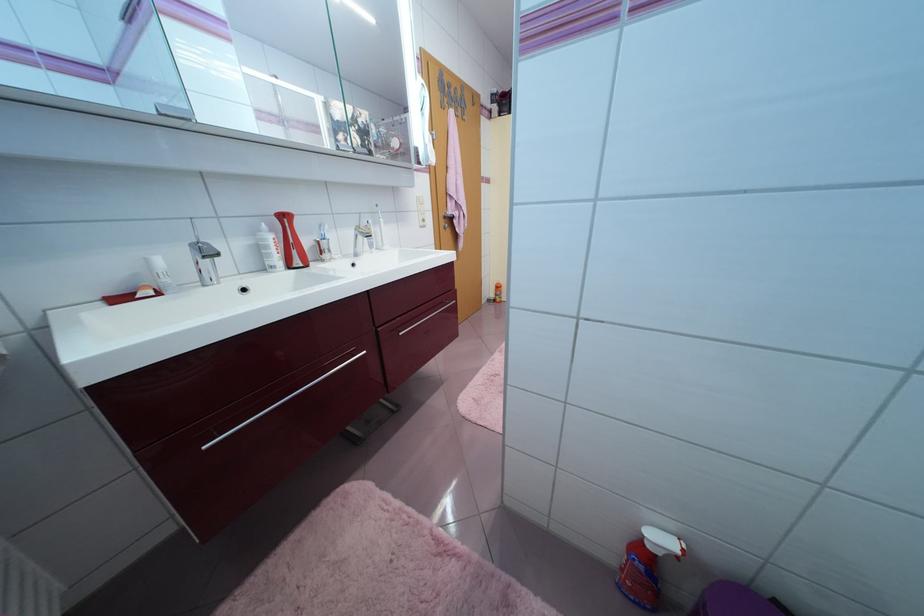
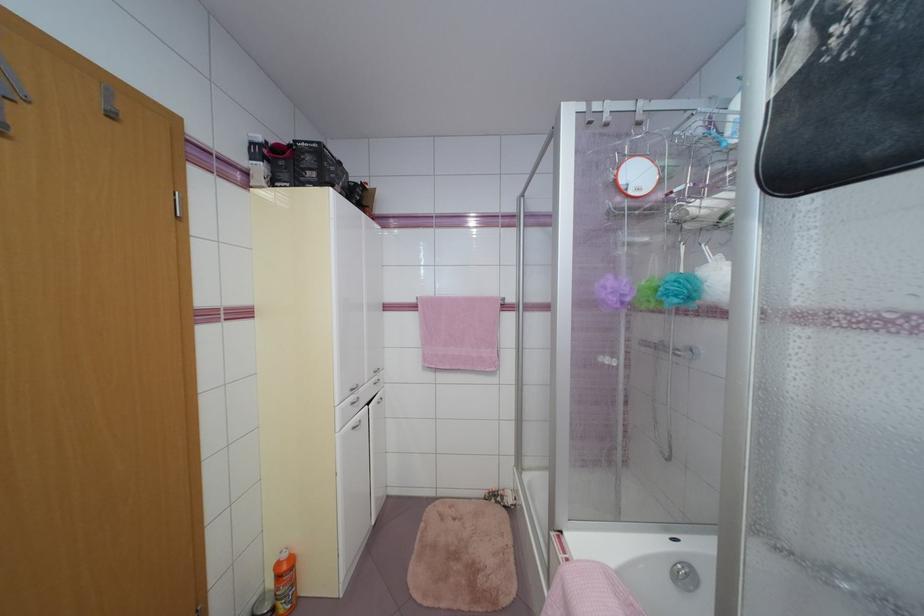
In the second image, find the point that corresponds to (504,301) in the first image.

(287, 610)